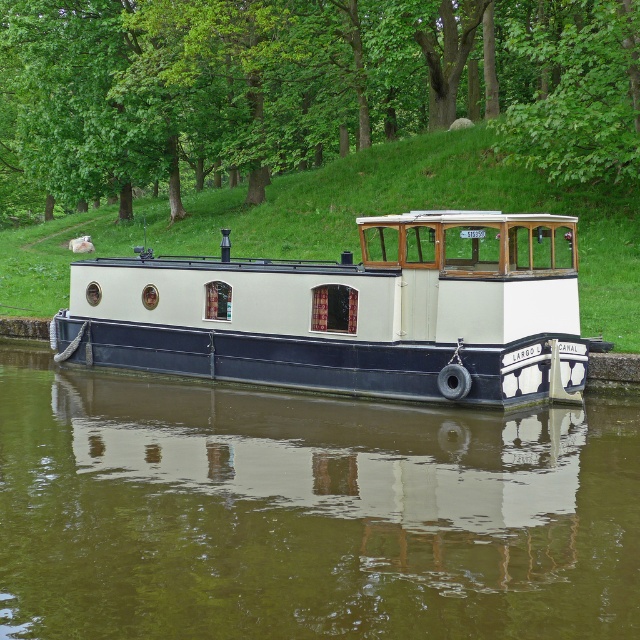
Question: Can you confirm if greenish water at center is thinner than white matte boat at center?

Choices:
 (A) yes
 (B) no

Answer: (A)

Question: Which of the following is the farthest from the observer?

Choices:
 (A) (396, 29)
 (B) (188, 342)

Answer: (A)

Question: Estimate the real-world distances between objects in this image. Which object is farther from the green leafy tree at upper center?

Choices:
 (A) greenish water at center
 (B) white matte boat at center

Answer: (A)

Question: Can you confirm if greenish water at center is smaller than green leafy tree at upper center?

Choices:
 (A) no
 (B) yes

Answer: (B)

Question: Considering the relative positions of green leafy tree at upper center and white matte boat at center in the image provided, where is green leafy tree at upper center located with respect to white matte boat at center?

Choices:
 (A) right
 (B) left

Answer: (B)

Question: Which of these objects is positioned closest to the green leafy tree at upper center?

Choices:
 (A) greenish water at center
 (B) white matte boat at center

Answer: (B)